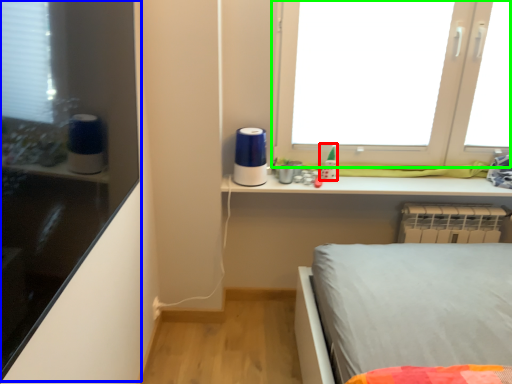
Question: Considering the real-world distances, which object is farthest from toy (highlighted by a red box)? shelf (highlighted by a blue box) or window (highlighted by a green box)?

Choices:
 (A) shelf
 (B) window

Answer: (A)